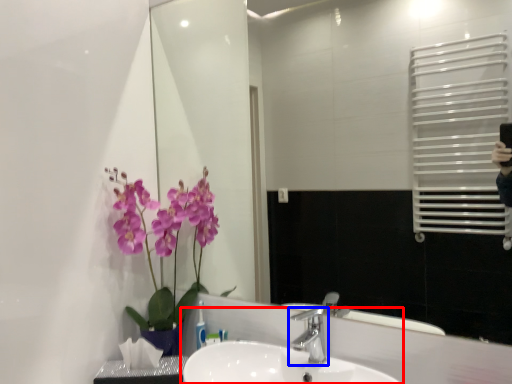
Question: Among these objects, which one is farthest to the camera, sink (highlighted by a red box) or tap (highlighted by a blue box)?

Choices:
 (A) sink
 (B) tap

Answer: (B)